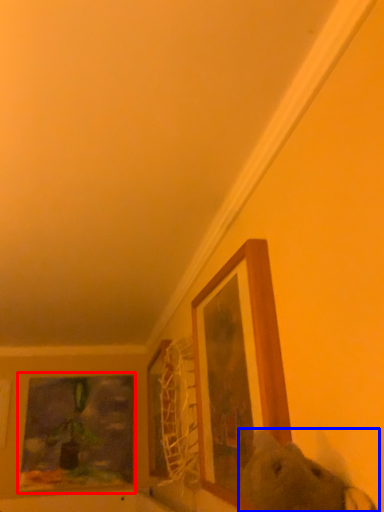
Question: Which point is further to the camera, picture frame (highlighted by a red box) or animal (highlighted by a blue box)?

Choices:
 (A) picture frame
 (B) animal

Answer: (A)